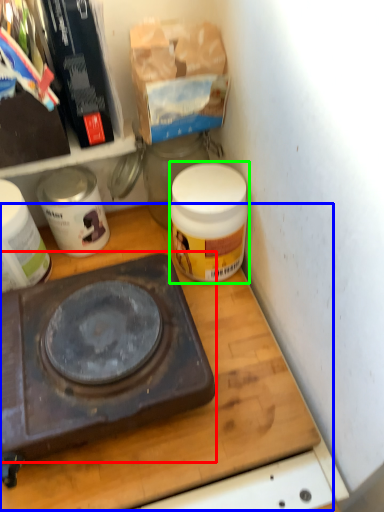
Question: Which object is the closest to the gas stove (highlighted by a red box)? Choose among these: table (highlighted by a blue box) or product (highlighted by a green box).

Choices:
 (A) table
 (B) product

Answer: (A)